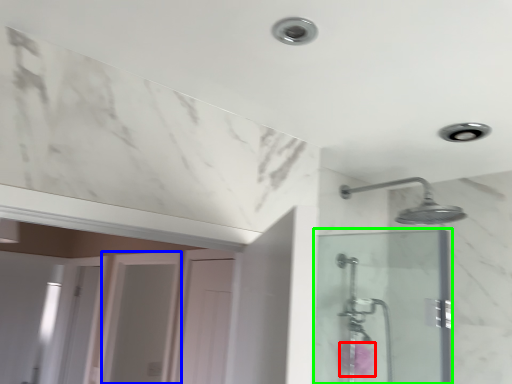
Question: Considering the real-world distances, which object is closest to flower (highlighted by a red box)? screen door (highlighted by a blue box) or screen door (highlighted by a green box).

Choices:
 (A) screen door
 (B) screen door

Answer: (B)